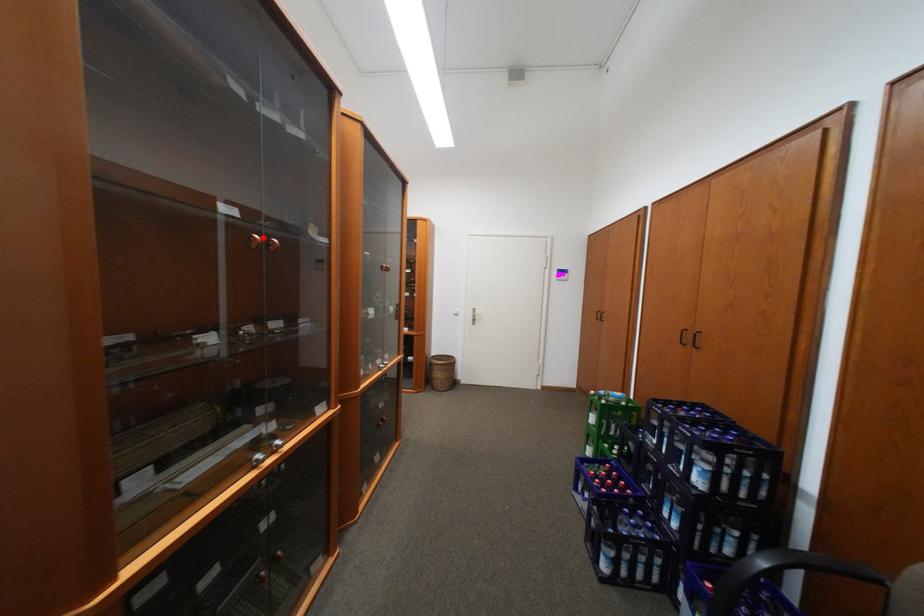
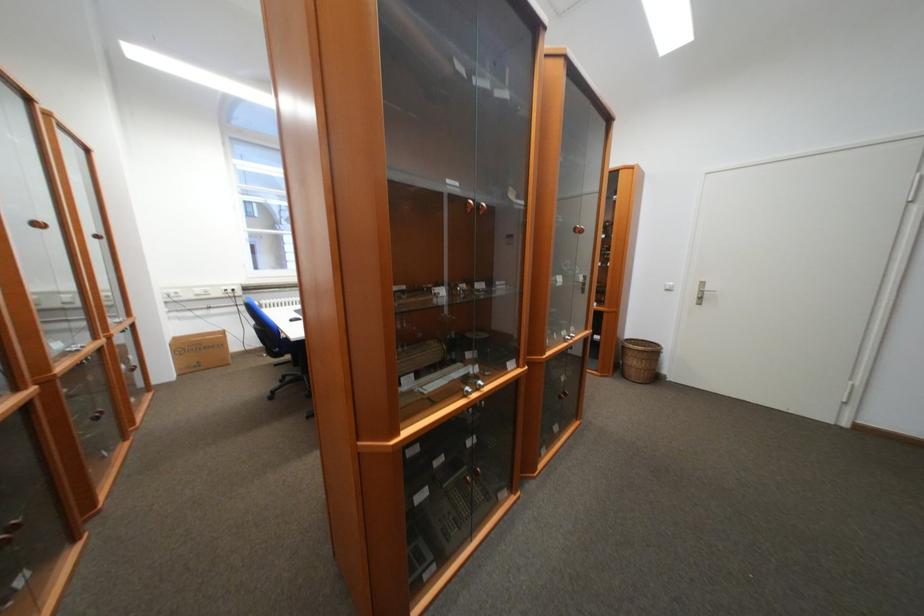
Locate, in the second image, the point that corresponds to the highlighted location in the first image.

(479, 204)